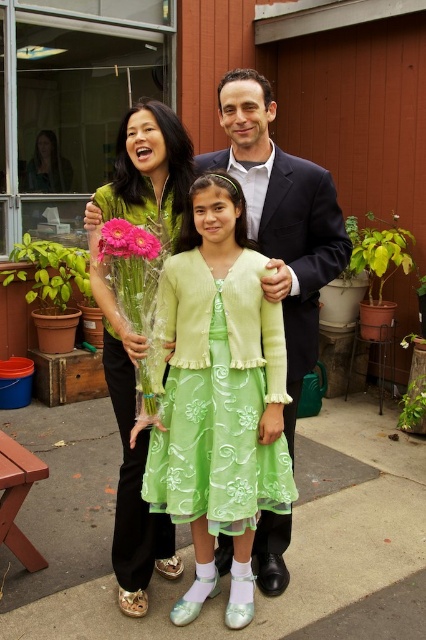
Question: Where is dark blue suit at center located in relation to pink matte gerbera at center in the image?

Choices:
 (A) left
 (B) right

Answer: (B)

Question: Can you confirm if dark blue suit at center is positioned to the left of pink matte gerbera at center?

Choices:
 (A) no
 (B) yes

Answer: (A)

Question: Which of the following is the closest to the observer?

Choices:
 (A) pink matte gerbera at center
 (B) dark blue suit at center

Answer: (A)

Question: Which of the following is the farthest from the observer?

Choices:
 (A) pink matte gerbera at center
 (B) lime green satin dress at center
 (C) matte green dress at left
 (D) dark blue suit at center

Answer: (D)

Question: Is lime green satin dress at center wider than dark blue suit at center?

Choices:
 (A) no
 (B) yes

Answer: (A)

Question: Estimate the real-world distances between objects in this image. Which object is farther from the matte green dress at left?

Choices:
 (A) lime green satin dress at center
 (B) pink matte gerbera at center

Answer: (B)